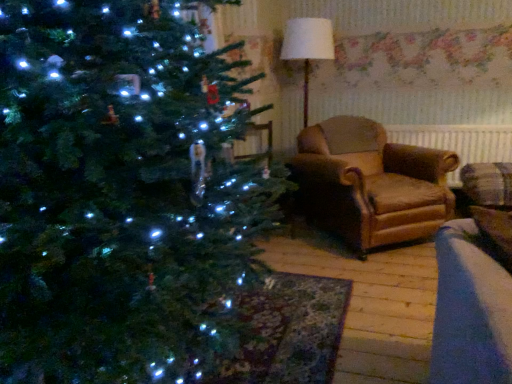
Locate an element on the screen. Image resolution: width=512 pixels, height=384 pixels. vacant point above brown fabric radiator at right (from a real-world perspective) is located at coordinates (455, 124).